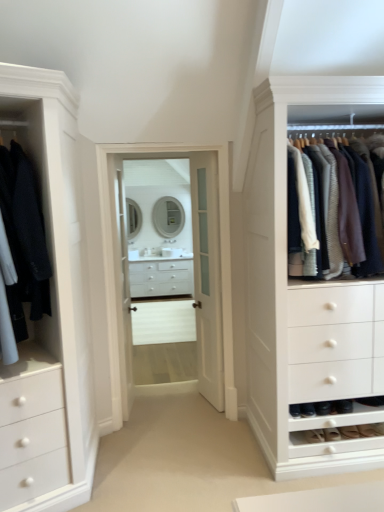
At what (x,y) coordinates should I click in order to perform the action: click on vacant space that's between clear glass door at center, the second glass door viewed from the right, and white glass door at center. Please return your answer as a coordinate pair (x, y). Image resolution: width=384 pixels, height=512 pixels. Looking at the image, I should click on (170, 408).